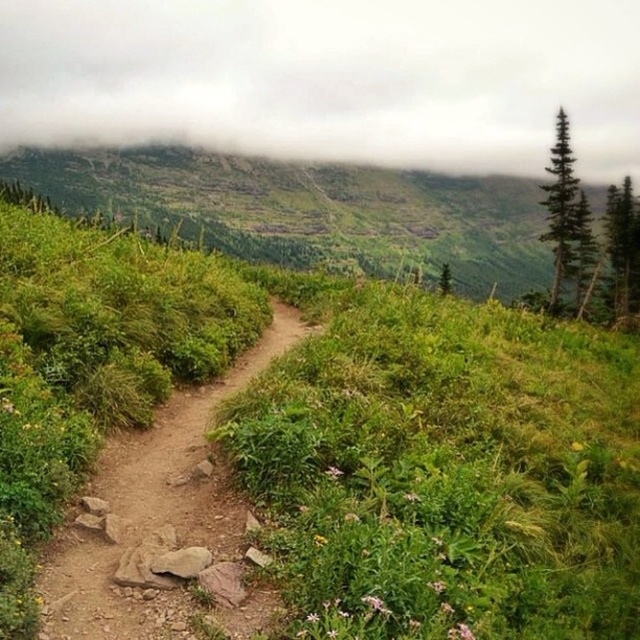
Is white fluffy cloud at upper center taller than green textured pine at right?

Yes, white fluffy cloud at upper center is taller than green textured pine at right.

Does white fluffy cloud at upper center have a greater width compared to green textured pine at right?

Correct, the width of white fluffy cloud at upper center exceeds that of green textured pine at right.

Which is in front, point (113, 122) or point (609, 259)?

Point (609, 259) is more forward.

Locate an element on the screen. white fluffy cloud at upper center is located at coordinates (330, 80).

Is white fluffy cloud at upper center smaller than green needle-like tree at upper right?

Actually, white fluffy cloud at upper center might be larger than green needle-like tree at upper right.

Is point (220, 38) closer to camera compared to point (550, 300)?

No, (220, 38) is behind (550, 300).

Is point (132, 109) more distant than point (588, 227)?

Yes, point (132, 109) is behind point (588, 227).

Locate an element on the screen. The height and width of the screenshot is (640, 640). white fluffy cloud at upper center is located at coordinates (330, 80).

Does green leafy grass at center appear on the left side of white fluffy cloud at upper center?

Indeed, green leafy grass at center is positioned on the left side of white fluffy cloud at upper center.

Which is behind, point (563, 442) or point (131, 48)?

The point (131, 48) is more distant.

Is point (436, 358) behind point (1, 140)?

No, (436, 358) is closer to viewer.

At what (x,y) coordinates should I click in order to perform the action: click on green leafy grass at center. Please return your answer as a coordinate pair (x, y). This screenshot has height=640, width=640. Looking at the image, I should click on (380, 435).